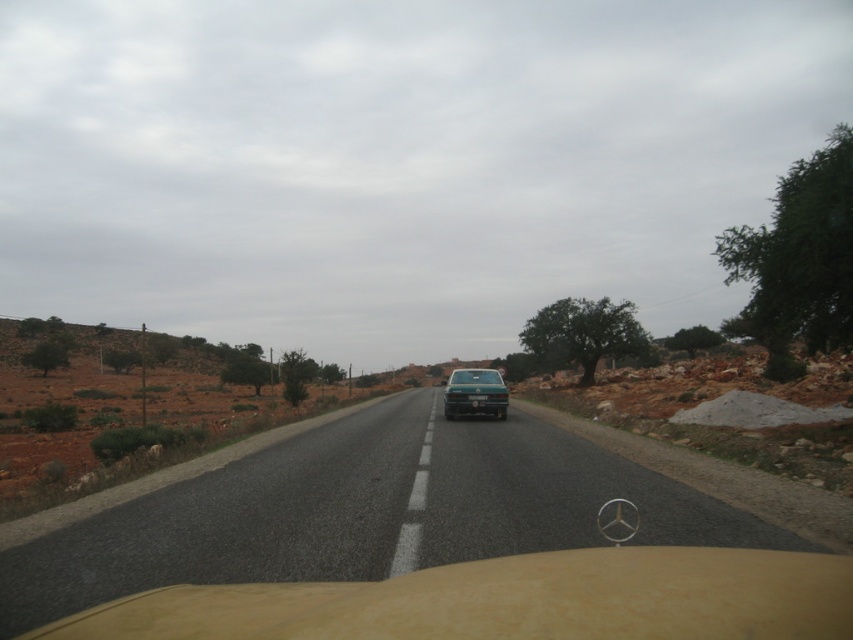
Can you confirm if asphalt road at center is positioned below green matte car at center?

Correct, asphalt road at center is located below green matte car at center.

Is point (103, 563) more distant than point (459, 412)?

No, it is in front of (459, 412).

This screenshot has width=853, height=640. What are the coordinates of `asphalt road at center` in the screenshot? It's located at (422, 545).